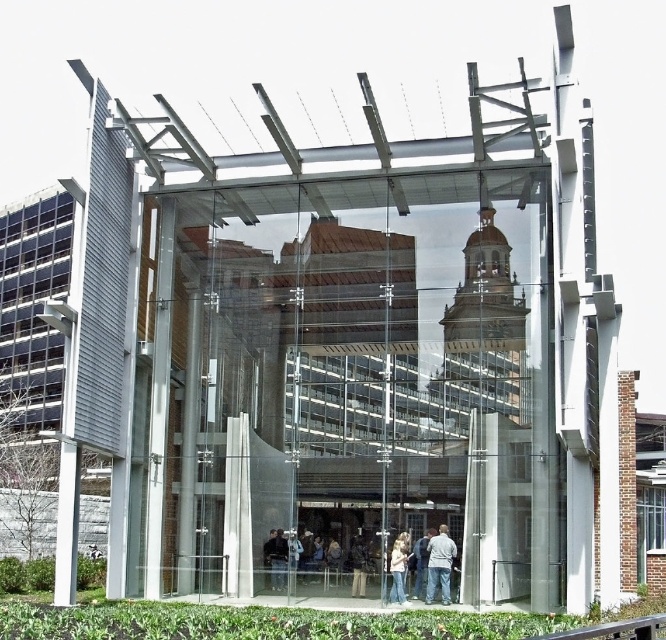
Is transparent glass box at center to the right of gray cotton shirt at center from the viewer's perspective?

In fact, transparent glass box at center is to the left of gray cotton shirt at center.

Does transparent glass box at center come behind gray cotton shirt at center?

No, transparent glass box at center is in front of gray cotton shirt at center.

Between point (236, 556) and point (434, 544), which one is positioned in front?

Positioned in front is point (236, 556).

The height and width of the screenshot is (640, 666). I want to click on transparent glass box at center, so click(352, 390).

Can you confirm if transparent glass box at center is positioned below light beige sweater at center?

Actually, transparent glass box at center is above light beige sweater at center.

Can you confirm if transparent glass box at center is shorter than light beige sweater at center?

In fact, transparent glass box at center may be taller than light beige sweater at center.

This screenshot has width=666, height=640. In order to click on transparent glass box at center in this screenshot , I will do `click(352, 390)`.

Looking at this image, which is more to the right, gray cotton shirt at center or light beige sweater at center?

gray cotton shirt at center

Is gray cotton shirt at center wider than light beige sweater at center?

Yes, gray cotton shirt at center is wider than light beige sweater at center.

You are a GUI agent. You are given a task and a screenshot of the screen. Output one action in this format:
    pyautogui.click(x=<x>, y=<y>)
    Task: Click on the gray cotton shirt at center
    This screenshot has width=666, height=640.
    Given the screenshot: What is the action you would take?
    pyautogui.click(x=440, y=564)

Locate an element on the screen. gray cotton shirt at center is located at coordinates (440, 564).